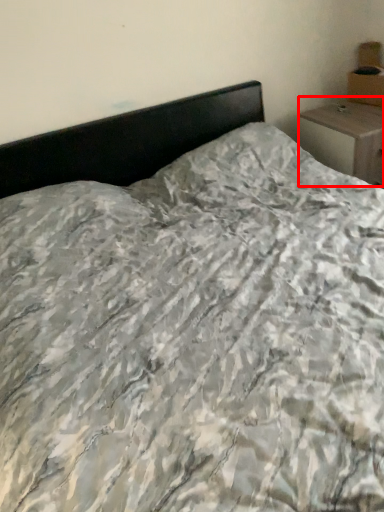
Question: Where is nightstand (annotated by the red box) located in relation to cardboard box in the image?

Choices:
 (A) right
 (B) left

Answer: (B)